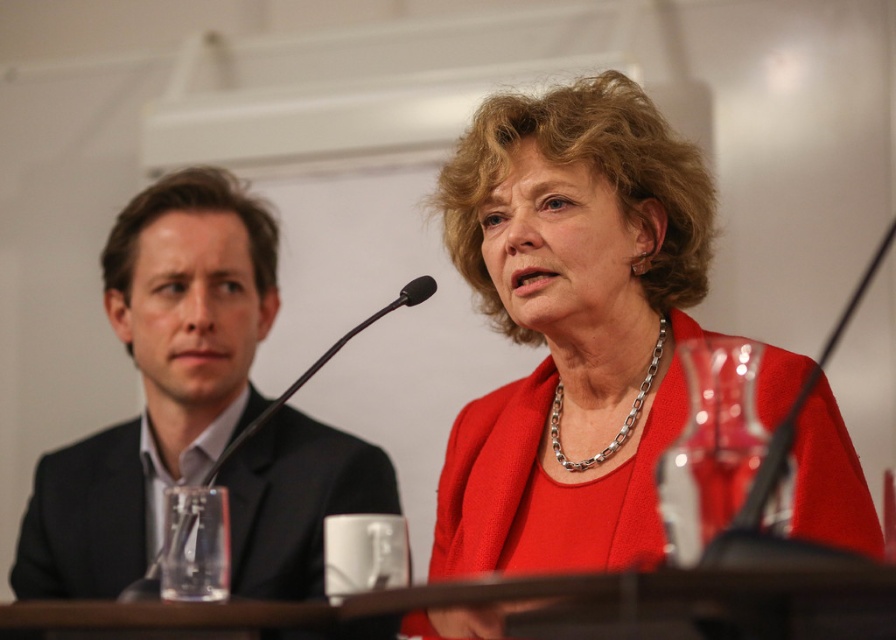
Based on the photo, you are standing at the point labeled point (x=662, y=342) and want to move to the point labeled point (x=266, y=500). Which direction should you move to reach your destination?

To move from point (x=662, y=342) to point (x=266, y=500), you should move forward because point (x=266, y=500) is behind point (x=662, y=342).

You are an event organizer arranging a photoshoot for a formal event. You need to position a spotlight on the person wearing the matte red blazer at center and the silver chain necklace at center. Based on their spatial arrangement, which object should the spotlight be placed to the right of to ensure both are illuminated?

The spotlight should be placed to the right of the silver chain necklace at center because the matte red blazer at center is to the left of it, so positioning the spotlight there will cover both objects in the illumination.